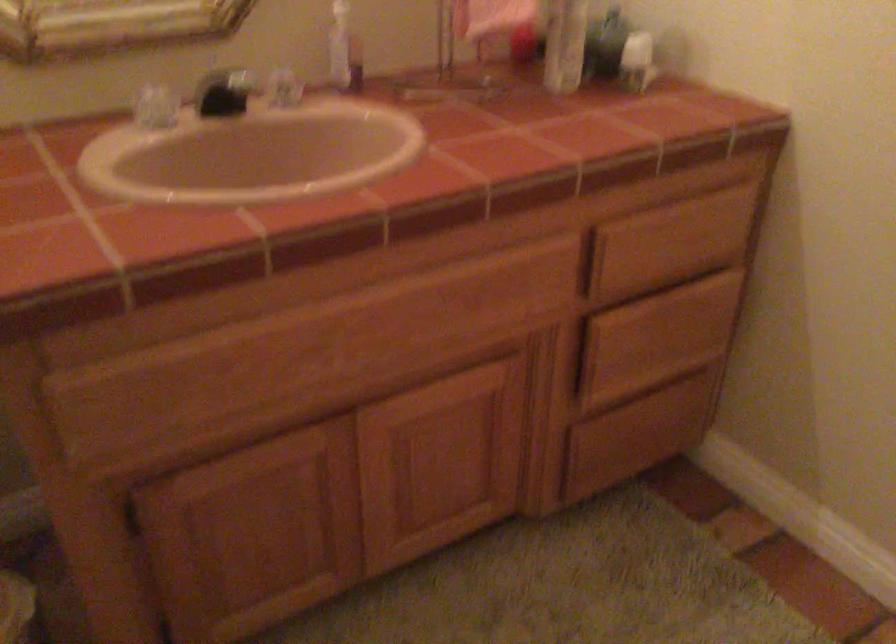
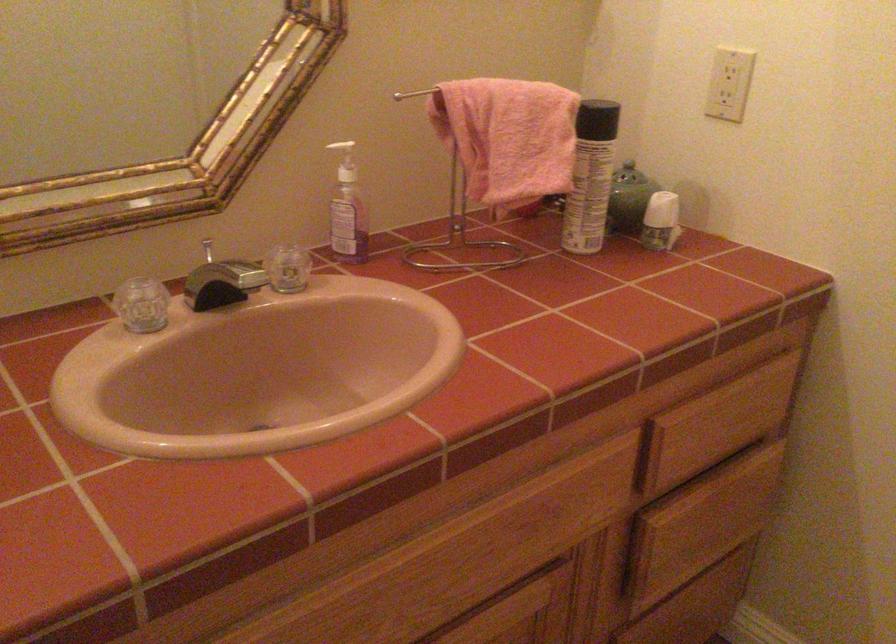
Find the pixel in the second image that matches (661,242) in the first image.

(718, 424)